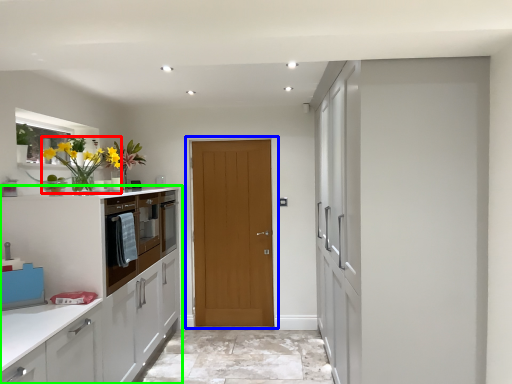
Question: Which is farther away from floral arrangement (highlighted by a red box)? door (highlighted by a blue box) or cabinetry (highlighted by a green box)?

Choices:
 (A) door
 (B) cabinetry

Answer: (A)